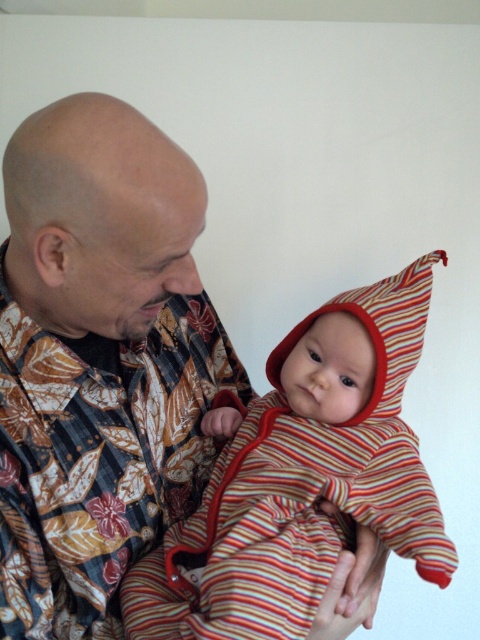
Does floral-patterned shirt at center come in front of striped fabric baby at center?

Yes, floral-patterned shirt at center is in front of striped fabric baby at center.

Which is above, floral-patterned shirt at center or striped fabric baby at center?

Positioned higher is floral-patterned shirt at center.

Which is behind, point (21, 369) or point (330, 387)?

The point (330, 387) is more distant.

Image resolution: width=480 pixels, height=640 pixels. What are the coordinates of `floral-patterned shirt at center` in the screenshot? It's located at (97, 358).